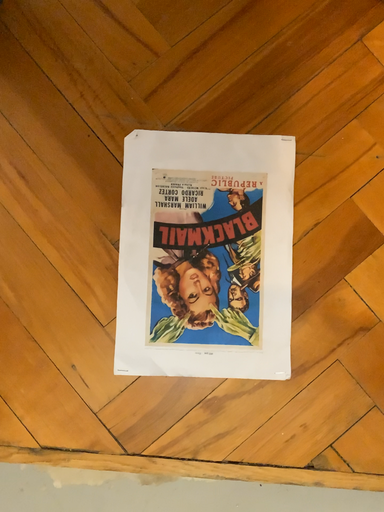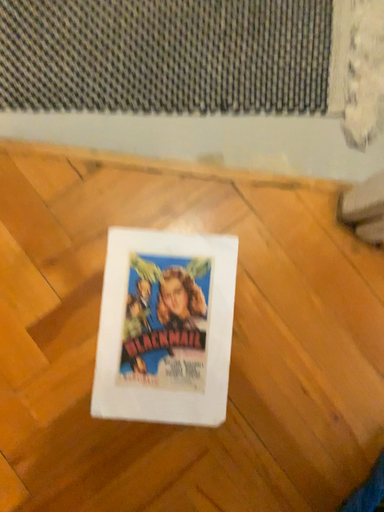
Question: How did the camera likely rotate when shooting the video?

Choices:
 (A) rotated downward
 (B) rotated upward

Answer: (B)